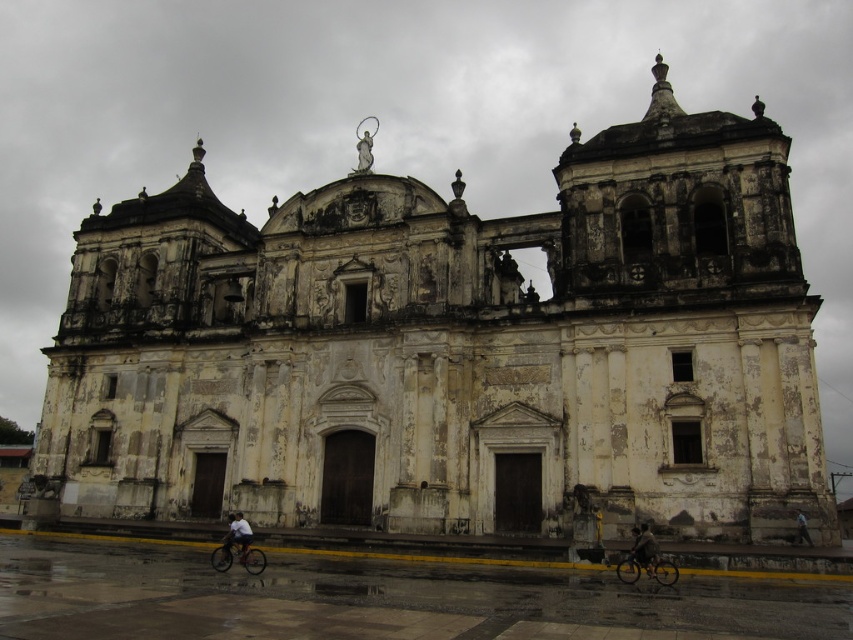
Question: Which object is positioned farthest from the dark gray fabric jacket at lower right?

Choices:
 (A) silver metallic bicycle at lower center
 (B) light blue shirt at center

Answer: (B)

Question: In this image, where is silver metallic bicycle at lower center located relative to light blue shirt at center?

Choices:
 (A) right
 (B) left

Answer: (A)

Question: Can you confirm if silver metallic bicycle at lower center is bigger than shiny metallic bicycle at lower right?

Choices:
 (A) no
 (B) yes

Answer: (B)

Question: Which point is closer to the camera taking this photo?

Choices:
 (A) tap(236, 547)
 (B) tap(248, 541)
 (C) tap(631, 554)

Answer: (C)

Question: Is silver metallic bicycle at lower center smaller than dark gray fabric jacket at lower right?

Choices:
 (A) yes
 (B) no

Answer: (B)

Question: Which object appears closest to the camera in this image?

Choices:
 (A) shiny metallic bicycle at lower right
 (B) dark gray fabric jacket at lower right
 (C) silver metallic bicycle at lower center
 (D) light blue shirt at center

Answer: (A)